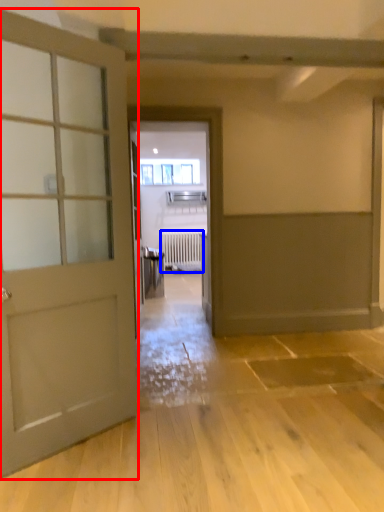
Question: Which object is further to the camera taking this photo, door (highlighted by a red box) or radiator (highlighted by a blue box)?

Choices:
 (A) door
 (B) radiator

Answer: (B)